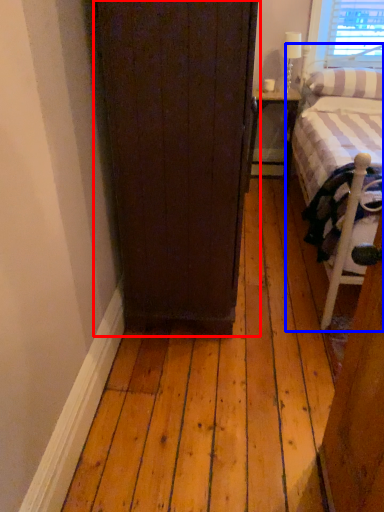
Question: Which object appears closest to the camera in this image, door (highlighted by a red box) or bed (highlighted by a blue box)?

Choices:
 (A) door
 (B) bed

Answer: (A)